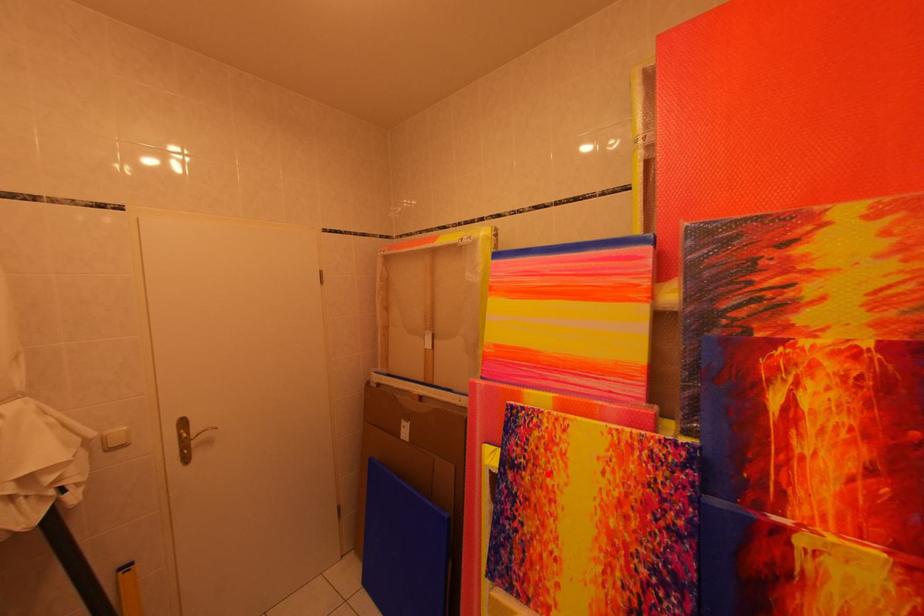
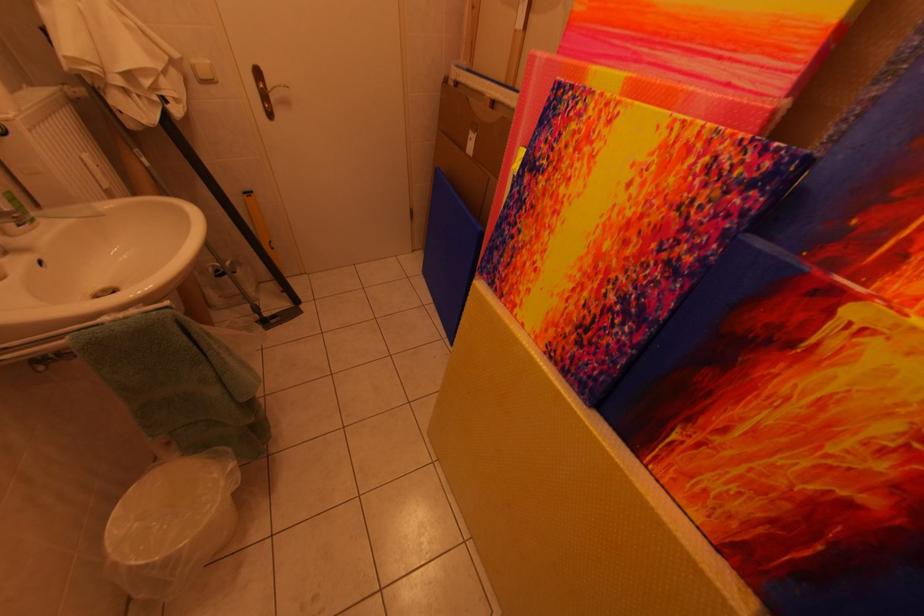
Where in the second image is the point corresponding to the highlighted location from the first image?

(565, 180)